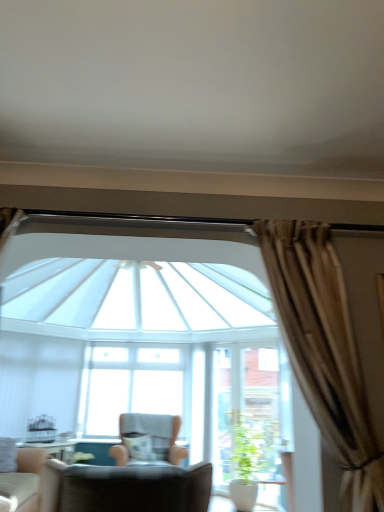
Question: Which is correct: white glass screen door at center is inside transparent glass window at center, or outside of it?

Choices:
 (A) inside
 (B) outside

Answer: (B)

Question: Considering the positions of white glass screen door at center and transparent glass window at center in the image, is white glass screen door at center wider or thinner than transparent glass window at center?

Choices:
 (A) wide
 (B) thin

Answer: (B)

Question: Based on their relative distances, which object is farther from the green matte plant at lower center?

Choices:
 (A) transparent glass window at center
 (B) beige fabric chair at center, the 3th chair when ordered from front to back
 (C) leather armchair at lower left, marked as the third chair in a back-to-front arrangement
 (D) light beige fabric chair at lower left, the 2th chair in the front-to-back sequence
 (E) white glass screen door at center

Answer: (D)

Question: Which object is the closest to the green matte plant at lower center?

Choices:
 (A) beige fabric chair at center, the 1th chair when ordered from back to front
 (B) leather armchair at lower left, marked as the third chair in a back-to-front arrangement
 (C) light beige fabric chair at lower left, the 2th chair in the front-to-back sequence
 (D) transparent glass window at center
 (E) white glass screen door at center

Answer: (E)